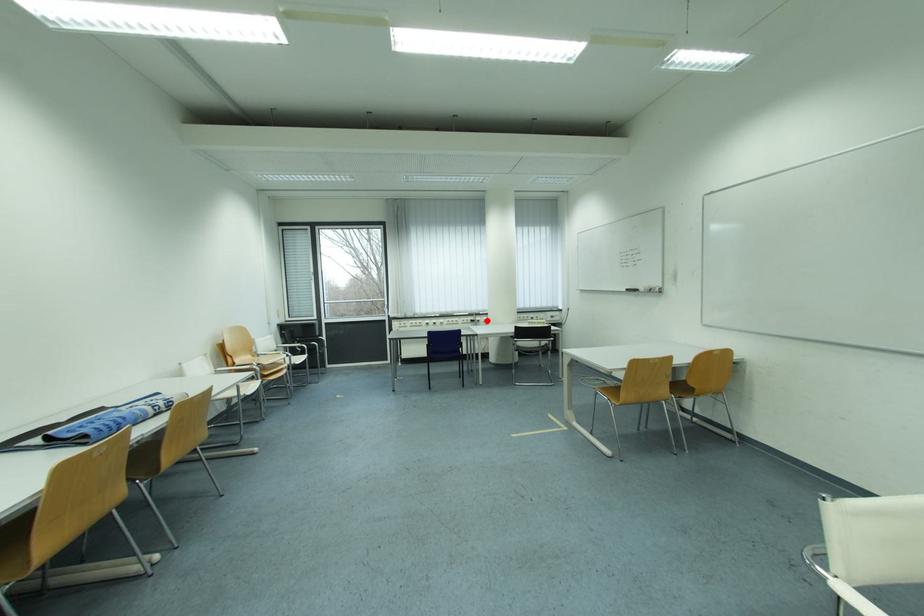
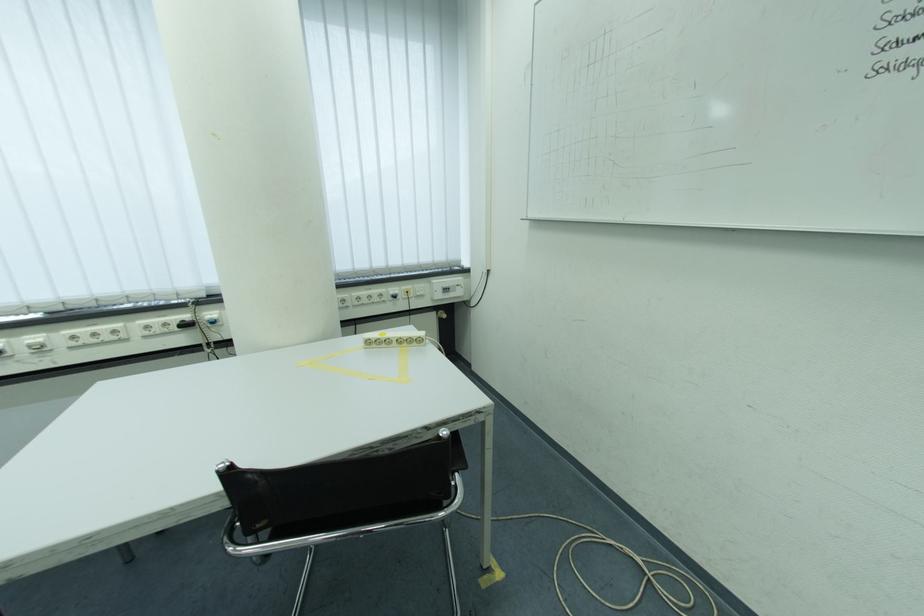
Question: I am providing you with two images of the same scene from different viewpoints. A red point is marked on the first image. Is the red point's position out of view in image 2?

Choices:
 (A) Yes
 (B) No

Answer: (B)